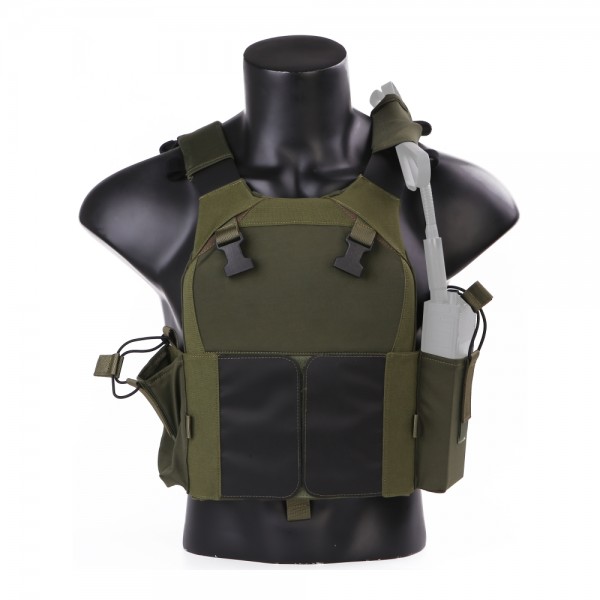
You are a GUI agent. You are given a task and a screenshot of the screen. Output one action in this format:
    pyautogui.click(x=<x>, y=<y>)
    Task: Click on the mannequin
    This screenshot has height=600, width=600.
    Given the screenshot: What is the action you would take?
    pyautogui.click(x=294, y=92)